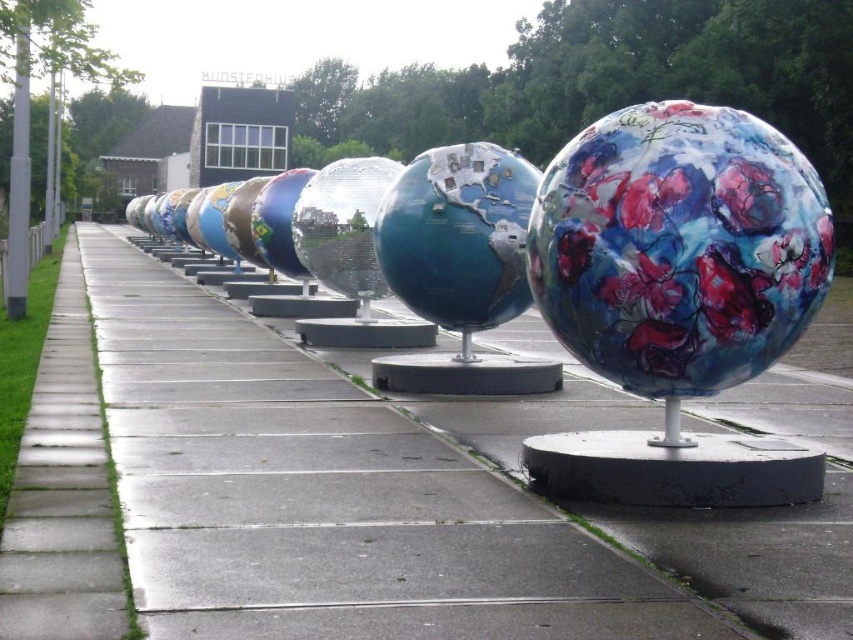
You are a maintenance worker tasked with inspecting the pathway. You see the concrete at center and the floral painted sphere at center. Which object is positioned to the left?

The concrete at center is to the left of the floral painted sphere at center, so the concrete at center is positioned to the left.

You are standing at the beginning of the pathway and see two points marked on the path. The first point is at coordinate point (x=229, y=625) and the second is at point (x=660, y=339). If you walk straight along the path, which point will you encounter first?

You will encounter point (x=229, y=625) first because it is in front of point (x=660, y=339) along the pathway.